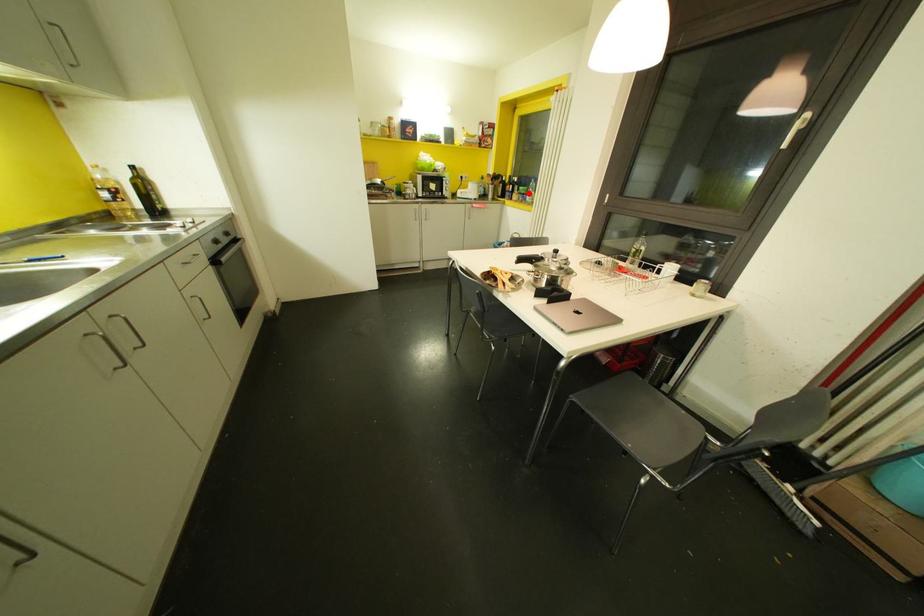
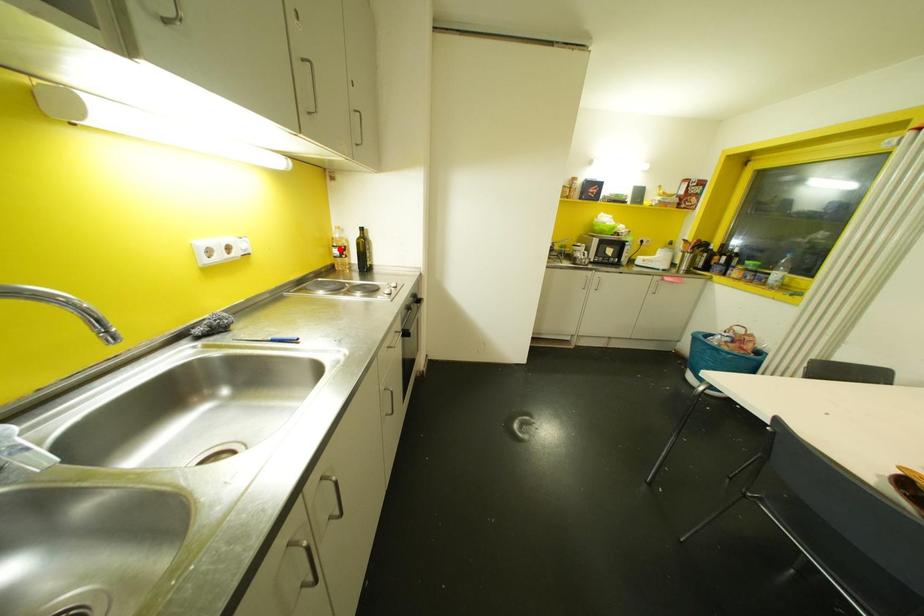
I am providing you with two images of the same scene from different viewpoints. A red point is marked on the first image and another point is marked on the second image. Are the points marked in image1 and image2 representing the same 3D position?

No